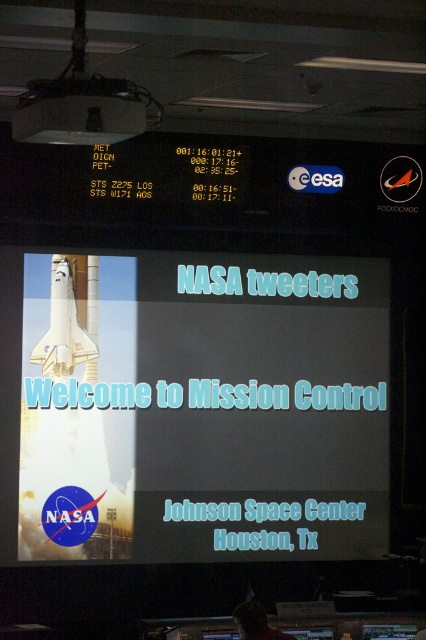
From the picture: Is white glossy rocket at center bigger than white matte shuttle at center?

Yes, white glossy rocket at center is bigger than white matte shuttle at center.

Can you confirm if white glossy rocket at center is thinner than white matte shuttle at center?

No.

Find the location of a particular element. This screenshot has height=640, width=426. white glossy rocket at center is located at coordinates click(192, 406).